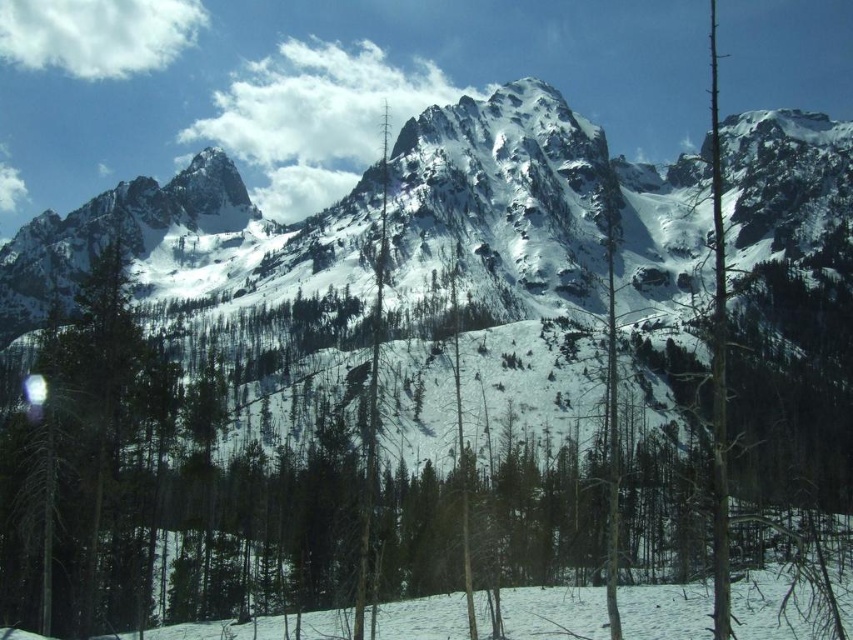
Question: Is white snow-covered mountain range at center bigger than smooth gray tree at center?

Choices:
 (A) no
 (B) yes

Answer: (B)

Question: Can you confirm if white snow-covered mountain range at center is bigger than smooth gray tree at center?

Choices:
 (A) no
 (B) yes

Answer: (B)

Question: Which point appears closest to the camera in this image?

Choices:
 (A) (570, 168)
 (B) (381, 186)

Answer: (B)

Question: Does white snow-covered mountain range at center appear on the right side of smooth gray tree at center?

Choices:
 (A) no
 (B) yes

Answer: (B)

Question: Which object appears closest to the camera in this image?

Choices:
 (A) white snow-covered mountain range at center
 (B) smooth gray tree at center

Answer: (B)

Question: Which point is farther from the camera taking this photo?

Choices:
 (A) (738, 170)
 (B) (358, 556)

Answer: (A)